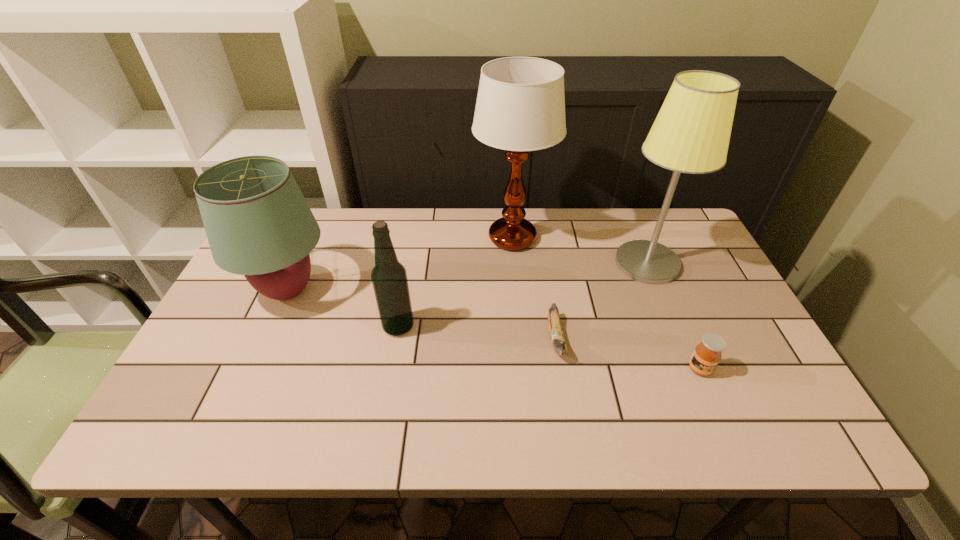
You are a GUI agent. You are given a task and a screenshot of the screen. Output one action in this format:
    pyautogui.click(x=<x>, y=<y>)
    Task: Click on the vacant space at the near right corner
    
    Given the screenshot: What is the action you would take?
    pyautogui.click(x=797, y=436)

The width and height of the screenshot is (960, 540). What are the coordinates of `free space between the honey and the fifth object from right to left` in the screenshot? It's located at (549, 348).

The width and height of the screenshot is (960, 540). In order to click on vacant space that's between the leftmost object and the right table lamp in this screenshot , I will do `click(468, 277)`.

The image size is (960, 540). What are the coordinates of `empty space between the banana and the right table lamp` in the screenshot? It's located at (602, 301).

Where is `free space between the right table lamp and the honey`? The width and height of the screenshot is (960, 540). free space between the right table lamp and the honey is located at coordinates (673, 316).

Find the location of a particular element. free spot between the leftmost object and the banana is located at coordinates (422, 315).

The width and height of the screenshot is (960, 540). In order to click on empty location between the right table lamp and the second object from left to right in this screenshot , I will do click(522, 295).

Locate an element on the screen. Image resolution: width=960 pixels, height=540 pixels. vacant space that's between the honey and the lampshade is located at coordinates (493, 330).

Identify the location of empty space between the lampshade and the banana. This screenshot has width=960, height=540. (422, 315).

Identify the location of free area in between the honey and the alcohol. (549, 348).